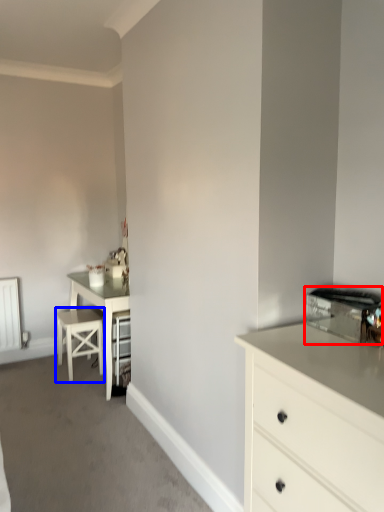
Question: Which object is closer to the camera taking this photo, appliance (highlighted by a red box) or bar stool (highlighted by a blue box)?

Choices:
 (A) appliance
 (B) bar stool

Answer: (A)